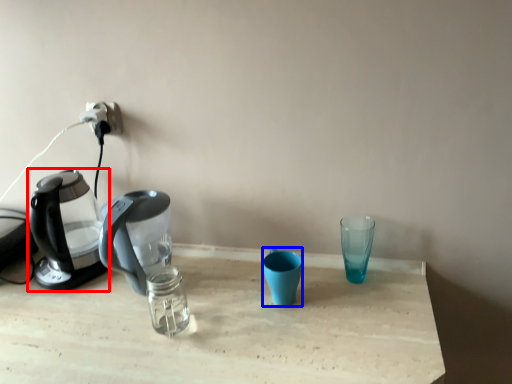
Question: Among these objects, which one is farthest to the camera, kettle (highlighted by a red box) or coffee cup (highlighted by a blue box)?

Choices:
 (A) kettle
 (B) coffee cup

Answer: (A)